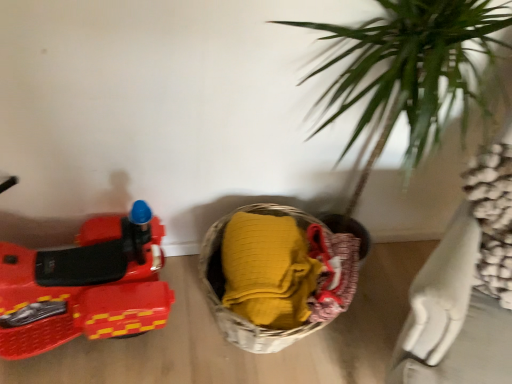
Question: Is shiny plastic toy car at left facing away from woven fabric basket at lower center?

Choices:
 (A) no
 (B) yes

Answer: (A)

Question: Does shiny plastic toy car at left have a greater height compared to woven fabric basket at lower center?

Choices:
 (A) no
 (B) yes

Answer: (B)

Question: From the image's perspective, is shiny plastic toy car at left under woven fabric basket at lower center?

Choices:
 (A) yes
 (B) no

Answer: (B)

Question: Is shiny plastic toy car at left wider than woven fabric basket at lower center?

Choices:
 (A) no
 (B) yes

Answer: (A)

Question: Is shiny plastic toy car at left outside of woven fabric basket at lower center?

Choices:
 (A) no
 (B) yes

Answer: (B)

Question: Does shiny plastic toy car at left touch woven fabric basket at lower center?

Choices:
 (A) yes
 (B) no

Answer: (B)

Question: Is woven fabric basket at lower center further to camera compared to shiny plastic toy car at left?

Choices:
 (A) yes
 (B) no

Answer: (A)

Question: Can you confirm if woven fabric basket at lower center is taller than shiny plastic toy car at left?

Choices:
 (A) yes
 (B) no

Answer: (B)

Question: Is woven fabric basket at lower center facing towards shiny plastic toy car at left?

Choices:
 (A) no
 (B) yes

Answer: (A)

Question: Considering the relative sizes of woven fabric basket at lower center and shiny plastic toy car at left in the image provided, is woven fabric basket at lower center shorter than shiny plastic toy car at left?

Choices:
 (A) yes
 (B) no

Answer: (A)

Question: Can you confirm if woven fabric basket at lower center is positioned to the right of shiny plastic toy car at left?

Choices:
 (A) no
 (B) yes

Answer: (B)

Question: Is there a large distance between woven fabric basket at lower center and shiny plastic toy car at left?

Choices:
 (A) no
 (B) yes

Answer: (A)

Question: In the image, is shiny plastic toy car at left on the left side or the right side of woven fabric basket at lower center?

Choices:
 (A) left
 (B) right

Answer: (A)